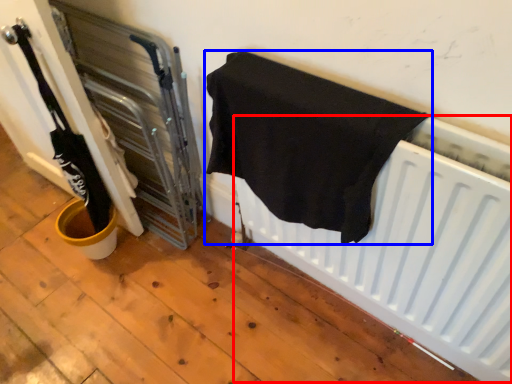
Question: Which object appears closest to the camera in this image, radiator (highlighted by a red box) or towel (highlighted by a blue box)?

Choices:
 (A) radiator
 (B) towel

Answer: (B)